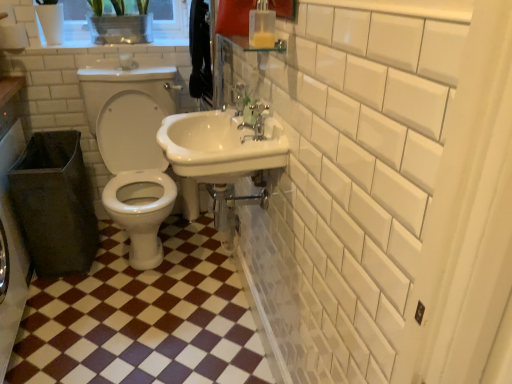
Question: Considering the relative sizes of brown glossy tile at center and white glossy sink at center in the image provided, is brown glossy tile at center smaller than white glossy sink at center?

Choices:
 (A) yes
 (B) no

Answer: (B)

Question: Is the depth of brown glossy tile at center less than that of white glossy sink at center?

Choices:
 (A) no
 (B) yes

Answer: (A)

Question: Is brown glossy tile at center turned away from white glossy sink at center?

Choices:
 (A) no
 (B) yes

Answer: (A)

Question: Can you confirm if brown glossy tile at center is wider than white glossy sink at center?

Choices:
 (A) yes
 (B) no

Answer: (A)

Question: From a real-world perspective, does brown glossy tile at center sit lower than white glossy sink at center?

Choices:
 (A) no
 (B) yes

Answer: (B)

Question: From their relative heights in the image, would you say brown glossy tile at center is taller or shorter than clear plastic container at upper left?

Choices:
 (A) tall
 (B) short

Answer: (B)

Question: Considering the positions of brown glossy tile at center and clear plastic container at upper left in the image, is brown glossy tile at center wider or thinner than clear plastic container at upper left?

Choices:
 (A) thin
 (B) wide

Answer: (B)

Question: From the image's perspective, relative to clear plastic container at upper left, is brown glossy tile at center above or below?

Choices:
 (A) below
 (B) above

Answer: (A)

Question: Which is correct: brown glossy tile at center is inside clear plastic container at upper left, or outside of it?

Choices:
 (A) outside
 (B) inside

Answer: (A)

Question: Is point (119, 16) positioned closer to the camera than point (88, 109)?

Choices:
 (A) closer
 (B) farther

Answer: (B)

Question: From a real-world perspective, relative to white glossy toilet at center, is clear plastic container at upper left vertically above or below?

Choices:
 (A) above
 (B) below

Answer: (A)

Question: Is clear plastic container at upper left wider or thinner than white glossy toilet at center?

Choices:
 (A) thin
 (B) wide

Answer: (A)

Question: Considering the relative positions of clear plastic container at upper left and white glossy toilet at center in the image provided, is clear plastic container at upper left to the left or to the right of white glossy toilet at center?

Choices:
 (A) left
 (B) right

Answer: (A)

Question: From a real-world perspective, is satin nickel faucet at upper center positioned above or below clear plastic container at upper left?

Choices:
 (A) below
 (B) above

Answer: (A)

Question: Is satin nickel faucet at upper center wider or thinner than clear plastic container at upper left?

Choices:
 (A) thin
 (B) wide

Answer: (A)